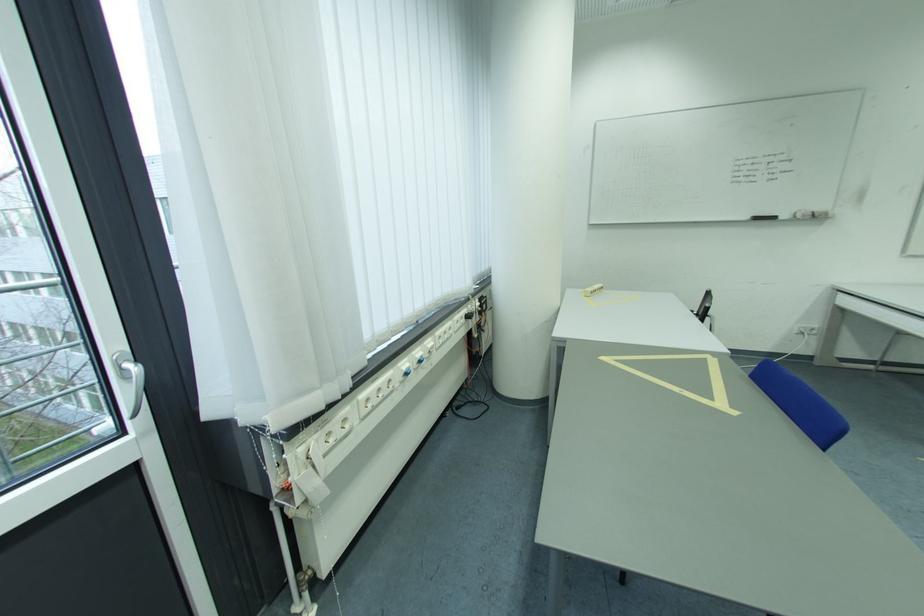
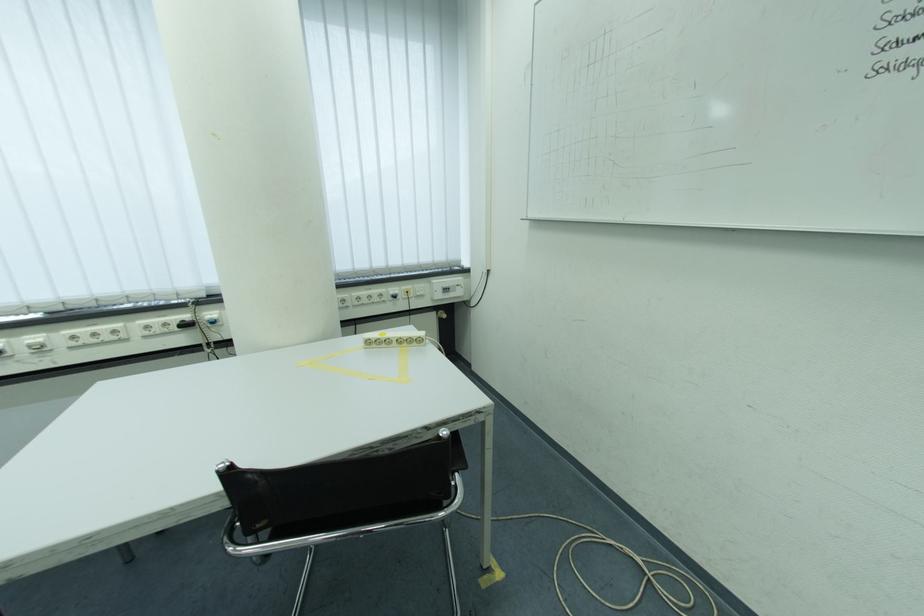
Locate, in the second image, the point that corresponds to the point at 441,346 in the first image.

(50, 342)